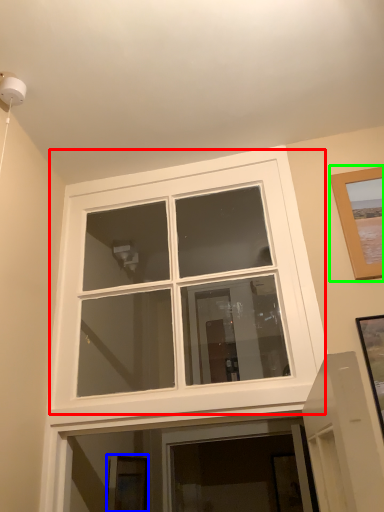
Question: Based on their relative distances, which object is farther from window (highlighted by a red box)? Choose from picture frame (highlighted by a blue box) and picture frame (highlighted by a green box).

Choices:
 (A) picture frame
 (B) picture frame

Answer: (B)